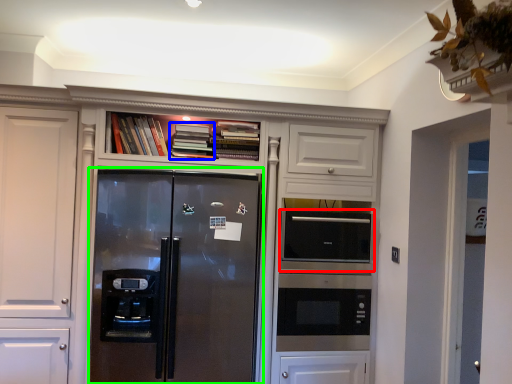
Question: Considering the real-world distances, which object is closest to appliance (highlighted by a red box)? book (highlighted by a blue box) or refrigerator (highlighted by a green box).

Choices:
 (A) book
 (B) refrigerator

Answer: (B)